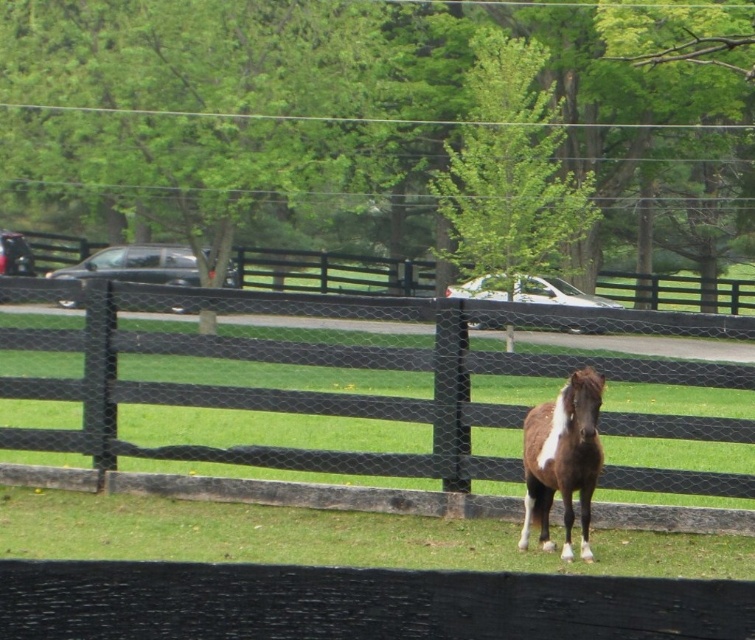
Does green grass at lower center appear over brown glossy horse at center?

Actually, green grass at lower center is below brown glossy horse at center.

Does green grass at lower center have a greater height compared to brown glossy horse at center?

No.

Who is more distant from viewer, (x=436, y=564) or (x=566, y=387)?

The point (x=436, y=564) is behind.

Locate an element on the screen. Image resolution: width=755 pixels, height=640 pixels. green grass at lower center is located at coordinates (330, 538).

You are a GUI agent. You are given a task and a screenshot of the screen. Output one action in this format:
    pyautogui.click(x=<x>, y=<y>)
    Task: Click on the black wooden fence at center
    The height and width of the screenshot is (640, 755).
    Given the screenshot: What is the action you would take?
    pyautogui.click(x=299, y=388)

Is black wooden fence at center below green grass at lower center?

No.

What do you see at coordinates (299, 388) in the screenshot?
I see `black wooden fence at center` at bounding box center [299, 388].

This screenshot has height=640, width=755. What are the coordinates of `black wooden fence at center` in the screenshot? It's located at (299, 388).

Is black wooden fence at center shorter than brown glossy horse at center?

Incorrect, black wooden fence at center's height does not fall short of brown glossy horse at center's.

Which is in front, point (88, 364) or point (569, 392)?

Point (569, 392) is more forward.

Locate an element on the screen. The image size is (755, 640). black wooden fence at center is located at coordinates (299, 388).